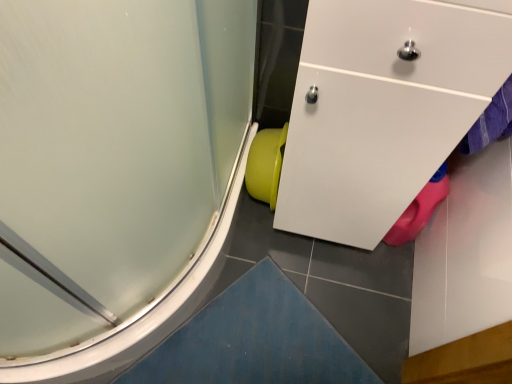
Question: Looking at their shapes, would you say frosted glass shower door at lower left is wider or thinner than matte plastic toilet bowl at lower center?

Choices:
 (A) wide
 (B) thin

Answer: (A)

Question: From a real-world perspective, relative to matte plastic toilet bowl at lower center, is frosted glass shower door at lower left vertically above or below?

Choices:
 (A) above
 (B) below

Answer: (A)

Question: Is point (174, 160) positioned closer to the camera than point (271, 195)?

Choices:
 (A) farther
 (B) closer

Answer: (B)

Question: In terms of size, does matte plastic toilet bowl at lower center appear bigger or smaller than frosted glass shower door at lower left?

Choices:
 (A) big
 (B) small

Answer: (B)

Question: Is point (256, 198) positioned closer to the camera than point (34, 132)?

Choices:
 (A) closer
 (B) farther

Answer: (B)

Question: Is matte plastic toilet bowl at lower center situated inside frosted glass shower door at lower left or outside?

Choices:
 (A) inside
 (B) outside

Answer: (B)

Question: From the image's perspective, is matte plastic toilet bowl at lower center positioned above or below frosted glass shower door at lower left?

Choices:
 (A) below
 (B) above

Answer: (A)